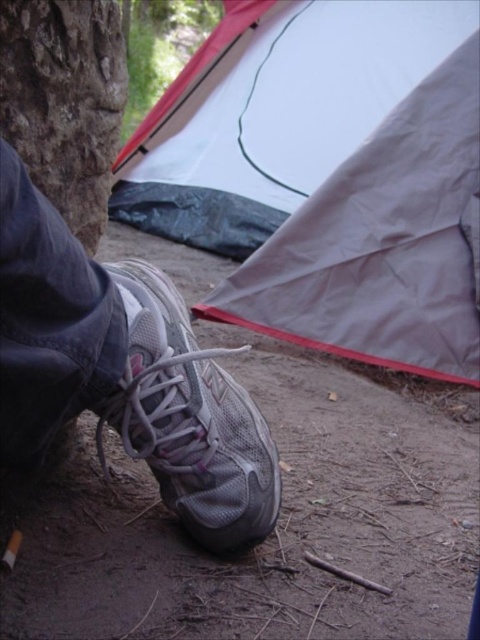
Question: Which point appears farthest from the camera in this image?

Choices:
 (A) (276, 148)
 (B) (212, 512)

Answer: (A)

Question: Does gray mesh shoe at lower left lie in front of white mesh shoe at lower left?

Choices:
 (A) yes
 (B) no

Answer: (A)

Question: Does white nylon tent at center have a larger size compared to rough textured rock at upper left?

Choices:
 (A) no
 (B) yes

Answer: (B)

Question: Which point is closer to the camera taking this photo?

Choices:
 (A) (96, 129)
 (B) (187, 138)

Answer: (A)

Question: Is gray mesh shoe at lower left to the right of rough textured rock at upper left from the viewer's perspective?

Choices:
 (A) yes
 (B) no

Answer: (A)

Question: Considering the real-world distances, which object is farthest from the white nylon tent at center?

Choices:
 (A) rough textured rock at upper left
 (B) gray mesh shoe at lower left
 (C) white mesh shoe at lower left

Answer: (B)